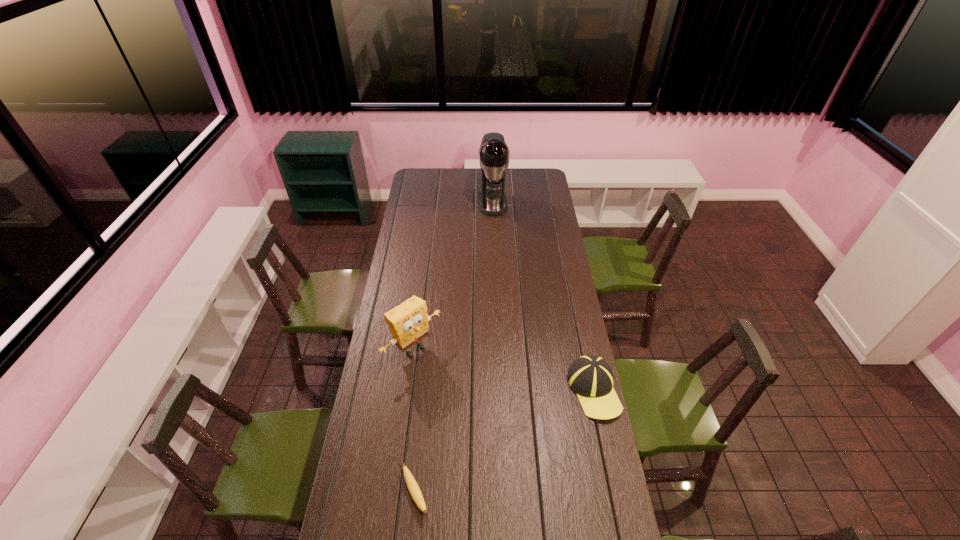
At what (x,y) coordinates should I click in order to perform the action: click on vacant space on the desktop that is between the banana and the baseball cap and is positioned on the face of the sponge. Please return your answer as a coordinate pair (x, y). Looking at the image, I should click on (509, 440).

Find the location of a particular element. free space on the desktop that is between the banana and the baseball cap and is positioned place cup under the spout of the tallest object is located at coordinates (520, 433).